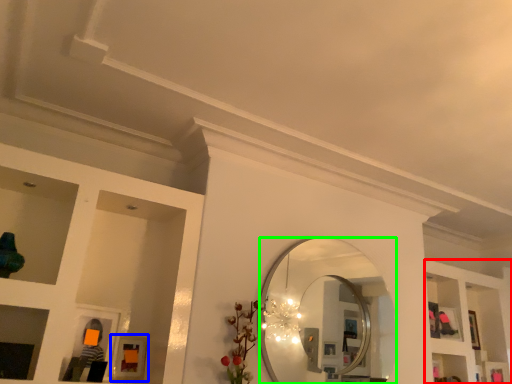
Question: Which is nearer to the shelf (highlighted by a red box)? picture frame (highlighted by a blue box) or mirror (highlighted by a green box).

Choices:
 (A) picture frame
 (B) mirror

Answer: (B)